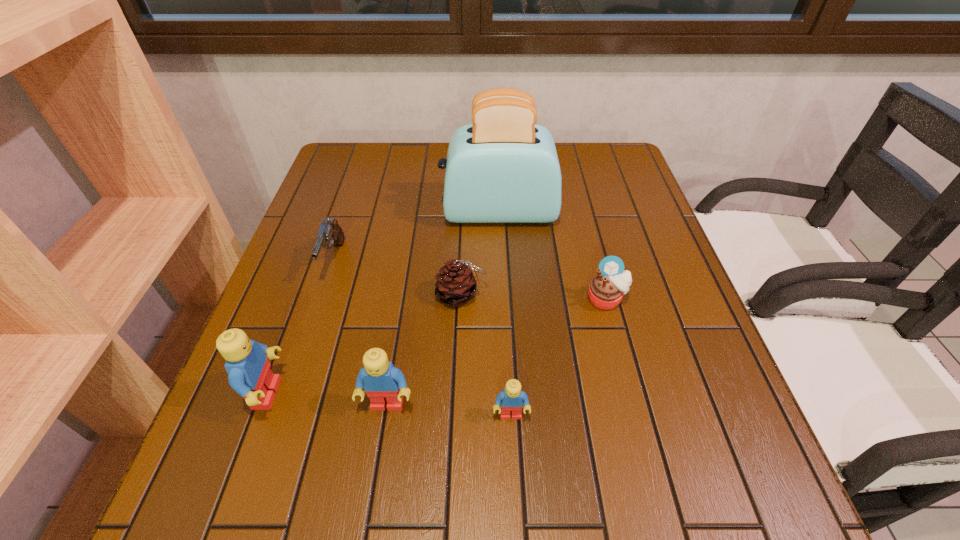
Locate an element on the screen. This screenshot has height=540, width=960. vacant space that satisfies the following two spatial constraints: 1. with a leaf charm attached to the pinecone; 2. on the face of the third tallest object is located at coordinates (457, 404).